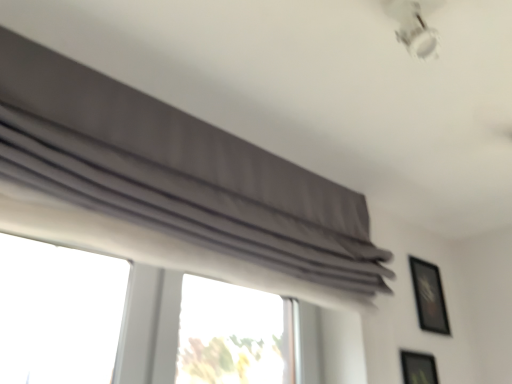
Question: Is black glossy picture frame at upper right, which ranks as the 2th picture frame in front-to-back order, closer to the viewer compared to gray fabric curtain at upper center?

Choices:
 (A) yes
 (B) no

Answer: (B)

Question: Does black glossy picture frame at upper right, which appears as the second picture frame when ordered from the bottom, have a lesser height compared to gray fabric curtain at upper center?

Choices:
 (A) yes
 (B) no

Answer: (A)

Question: Is the depth of black glossy picture frame at upper right, acting as the 1th picture frame starting from the back, greater than that of gray fabric curtain at upper center?

Choices:
 (A) yes
 (B) no

Answer: (A)

Question: From a real-world perspective, does black glossy picture frame at upper right, which ranks as the 2th picture frame in front-to-back order, sit lower than gray fabric curtain at upper center?

Choices:
 (A) no
 (B) yes

Answer: (B)

Question: From a real-world perspective, is black glossy picture frame at upper right, which ranks as the 2th picture frame in front-to-back order, over gray fabric curtain at upper center?

Choices:
 (A) no
 (B) yes

Answer: (A)

Question: Is point (394, 3) closer or farther from the camera than point (195, 135)?

Choices:
 (A) closer
 (B) farther

Answer: (A)

Question: In terms of height, does white glossy lamp at upper right look taller or shorter compared to gray fabric curtain at upper center?

Choices:
 (A) tall
 (B) short

Answer: (B)

Question: From the image's perspective, is white glossy lamp at upper right positioned above or below gray fabric curtain at upper center?

Choices:
 (A) above
 (B) below

Answer: (A)

Question: Is white glossy lamp at upper right to the left or to the right of gray fabric curtain at upper center in the image?

Choices:
 (A) right
 (B) left

Answer: (A)

Question: From the image's perspective, is matte black picture frame at lower right, which is counted as the 1th picture frame, starting from the front, located above or below black glossy picture frame at upper right, which ranks as the 2th picture frame in front-to-back order?

Choices:
 (A) below
 (B) above

Answer: (A)

Question: Is matte black picture frame at lower right, which is counted as the 1th picture frame, starting from the front, situated inside black glossy picture frame at upper right, acting as the 1th picture frame starting from the back, or outside?

Choices:
 (A) outside
 (B) inside

Answer: (A)

Question: In terms of width, does matte black picture frame at lower right, arranged as the second picture frame when viewed from the back, look wider or thinner when compared to black glossy picture frame at upper right, which ranks as the 2th picture frame in front-to-back order?

Choices:
 (A) thin
 (B) wide

Answer: (A)

Question: Does point (418, 367) appear closer or farther from the camera than point (417, 278)?

Choices:
 (A) closer
 (B) farther

Answer: (A)

Question: In terms of height, does black glossy picture frame at upper right, acting as the 1th picture frame starting from the top, look taller or shorter compared to white glossy lamp at upper right?

Choices:
 (A) short
 (B) tall

Answer: (B)

Question: Visually, is black glossy picture frame at upper right, acting as the 1th picture frame starting from the back, positioned to the left or to the right of white glossy lamp at upper right?

Choices:
 (A) right
 (B) left

Answer: (A)